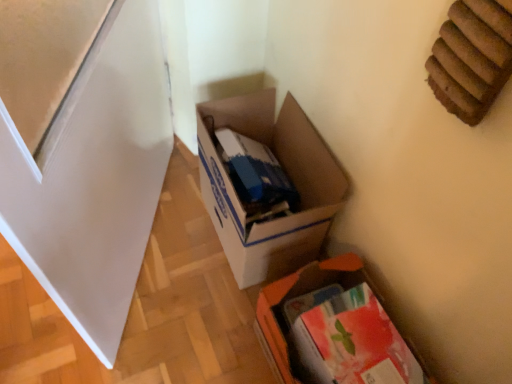
Question: Is orange fabric box at lower right, which ranks as the 2th box in top-to-bottom order, thinner than white cardboard box at center, which is the 2th box in bottom-to-top order?

Choices:
 (A) yes
 (B) no

Answer: (A)

Question: Does orange fabric box at lower right, the first box in the bottom-to-top sequence, have a lesser height compared to white cardboard box at center, which appears as the 1th box when viewed from the top?

Choices:
 (A) yes
 (B) no

Answer: (A)

Question: From a real-world perspective, is orange fabric box at lower right, which ranks as the 2th box in top-to-bottom order, below white cardboard box at center, which is the 2th box in bottom-to-top order?

Choices:
 (A) yes
 (B) no

Answer: (B)

Question: From the image's perspective, does orange fabric box at lower right, which ranks as the 2th box in top-to-bottom order, appear lower than white cardboard box at center, which appears as the 1th box when viewed from the top?

Choices:
 (A) no
 (B) yes

Answer: (B)

Question: Is orange fabric box at lower right, the first box in the bottom-to-top sequence, turned away from white cardboard box at center, which is the 2th box in bottom-to-top order?

Choices:
 (A) no
 (B) yes

Answer: (A)

Question: Is orange fabric box at lower right, the first box in the bottom-to-top sequence, bigger than white cardboard box at center, which is the 2th box in bottom-to-top order?

Choices:
 (A) yes
 (B) no

Answer: (B)

Question: Is white cardboard box at center, which appears as the 1th box when viewed from the top, further to the viewer compared to orange fabric box at lower right, which ranks as the 2th box in top-to-bottom order?

Choices:
 (A) yes
 (B) no

Answer: (A)

Question: Is white cardboard box at center, which appears as the 1th box when viewed from the top, to the right of orange fabric box at lower right, which ranks as the 2th box in top-to-bottom order, from the viewer's perspective?

Choices:
 (A) no
 (B) yes

Answer: (A)

Question: Is white cardboard box at center, which is the 2th box in bottom-to-top order, facing towards orange fabric box at lower right, the first box in the bottom-to-top sequence?

Choices:
 (A) no
 (B) yes

Answer: (A)

Question: From the image's perspective, would you say white cardboard box at center, which appears as the 1th box when viewed from the top, is shown under orange fabric box at lower right, which ranks as the 2th box in top-to-bottom order?

Choices:
 (A) yes
 (B) no

Answer: (B)

Question: Would you say orange fabric box at lower right, the first box in the bottom-to-top sequence, is part of white cardboard box at center, which appears as the 1th box when viewed from the top,'s contents?

Choices:
 (A) yes
 (B) no

Answer: (B)

Question: Is white cardboard box at center, which appears as the 1th box when viewed from the top, beside orange fabric box at lower right, which ranks as the 2th box in top-to-bottom order?

Choices:
 (A) yes
 (B) no

Answer: (B)

Question: Is point (351, 357) closer or farther from the camera than point (330, 162)?

Choices:
 (A) closer
 (B) farther

Answer: (A)